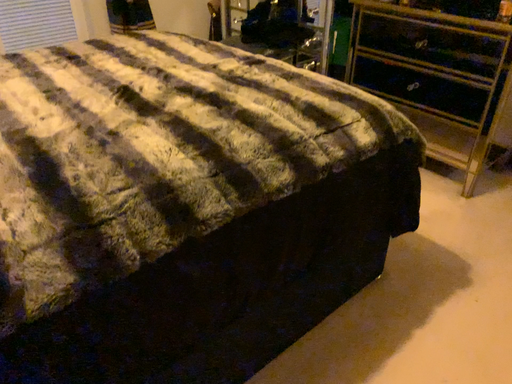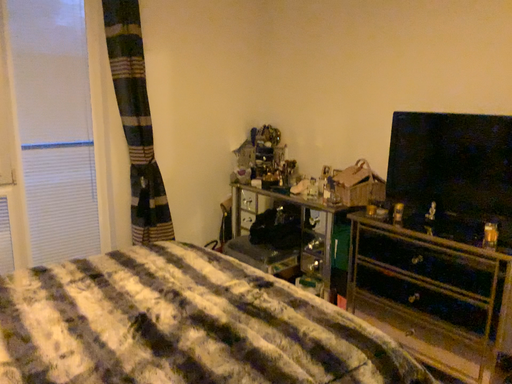
Question: Which way did the camera rotate in the video?

Choices:
 (A) rotated downward
 (B) rotated upward

Answer: (B)